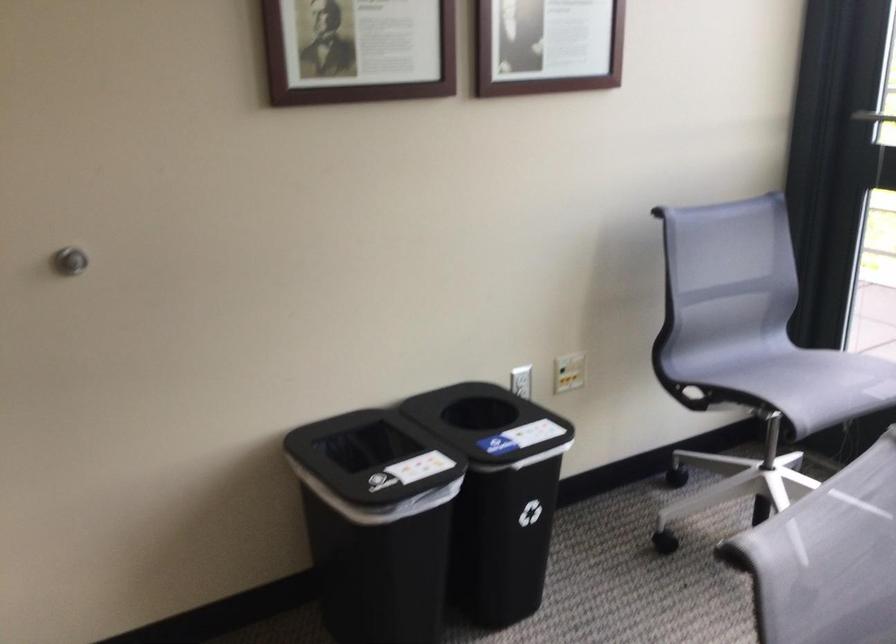
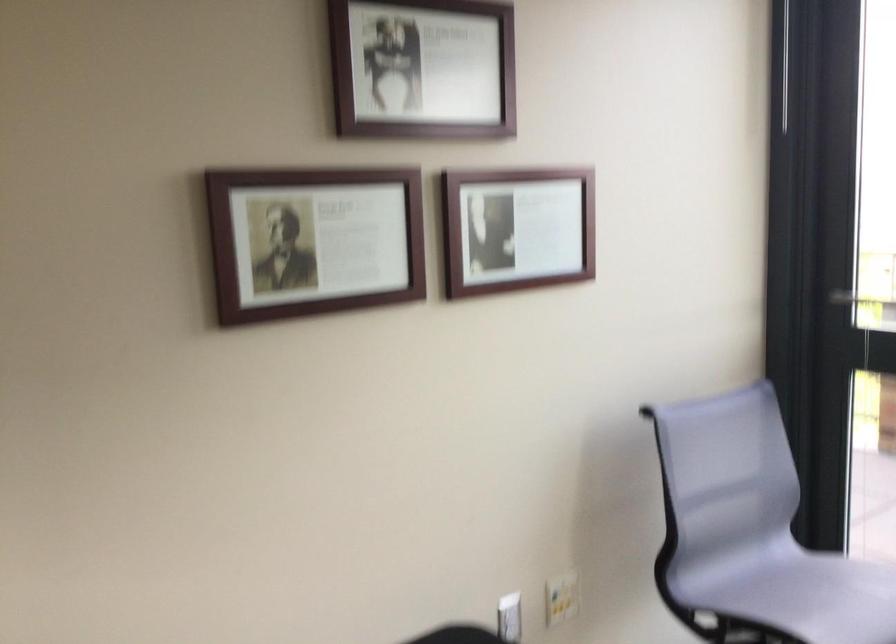
Question: Based on the continuous images, in which direction is the camera rotating? Reply with the corresponding letter.

Choices:
 (A) Left
 (B) Right
 (C) Up
 (D) Down

Answer: (C)